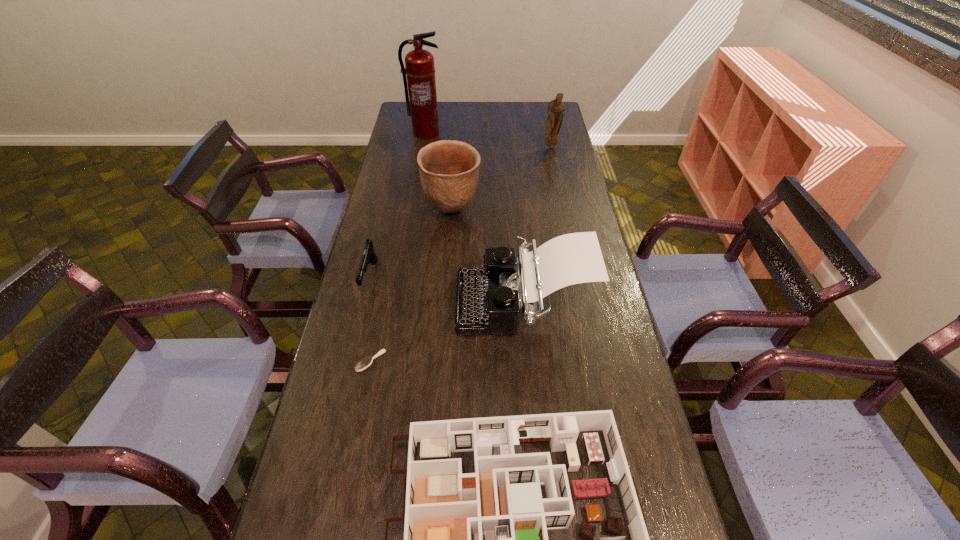
At what (x,y) coordinates should I click in order to perform the action: click on the tallest object. Please return your answer as a coordinate pair (x, y). Image resolution: width=960 pixels, height=540 pixels. Looking at the image, I should click on (420, 70).

Find the location of `the farthest object`. the farthest object is located at coordinates (420, 70).

The image size is (960, 540). What are the coordinates of `figurine` in the screenshot? It's located at pos(555,111).

Locate an element on the screen. This screenshot has height=540, width=960. pottery is located at coordinates tap(448, 170).

Find the location of a particular element. The image size is (960, 540). typewriter is located at coordinates (488, 301).

What are the coordinates of `gun` in the screenshot? It's located at (369, 256).

The height and width of the screenshot is (540, 960). In order to click on the sixth farthest object in this screenshot , I will do `click(366, 362)`.

Where is `the shortest object`? The height and width of the screenshot is (540, 960). the shortest object is located at coordinates (366, 362).

Where is `vacant space situated on the side of the tallest object with the handle and hose`? Image resolution: width=960 pixels, height=540 pixels. vacant space situated on the side of the tallest object with the handle and hose is located at coordinates (419, 173).

This screenshot has width=960, height=540. Find the location of `vacant space located 0.170m on the front-facing side of the second farthest object`. vacant space located 0.170m on the front-facing side of the second farthest object is located at coordinates (556, 170).